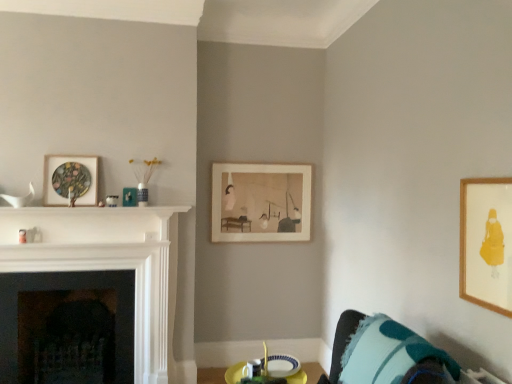
What are the coordinates of `free point above matte wooden picture frame at upper left, placed as the second picture frame when sorted from back to front (from a real-world perspective)` in the screenshot? It's located at point(71,158).